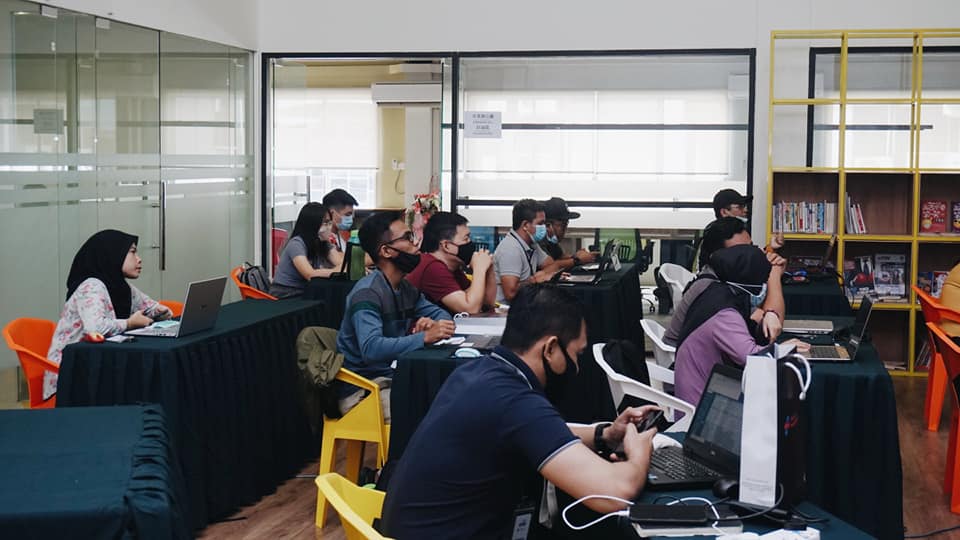
Locate an element on the screen. paper sign is located at coordinates (487, 125).